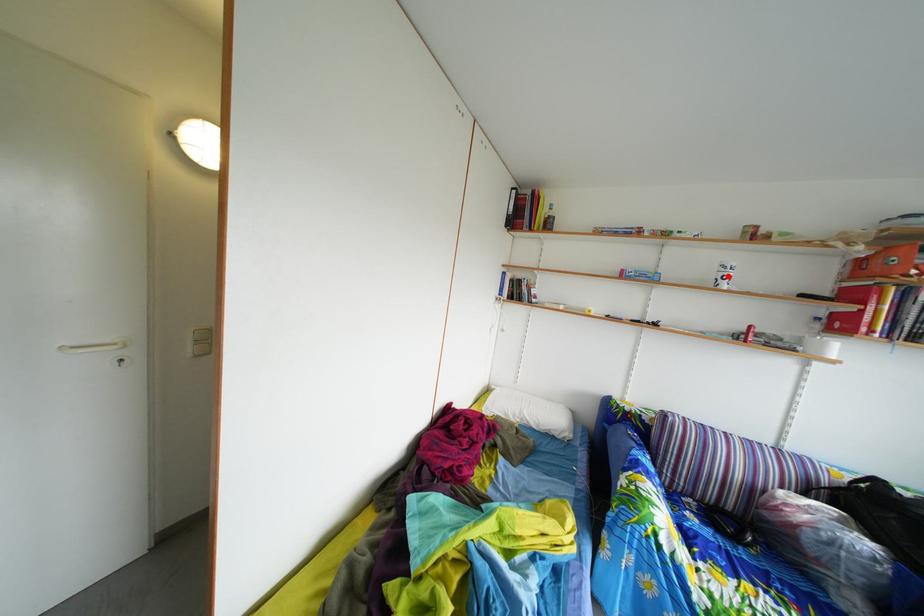
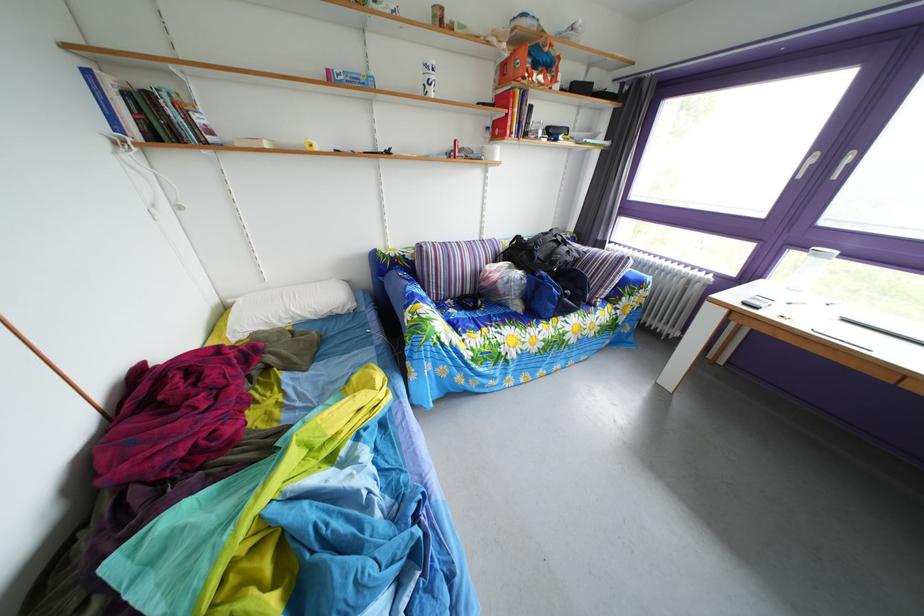
In the second image, find the point that corresponds to the highlighted location in the first image.

(432, 79)